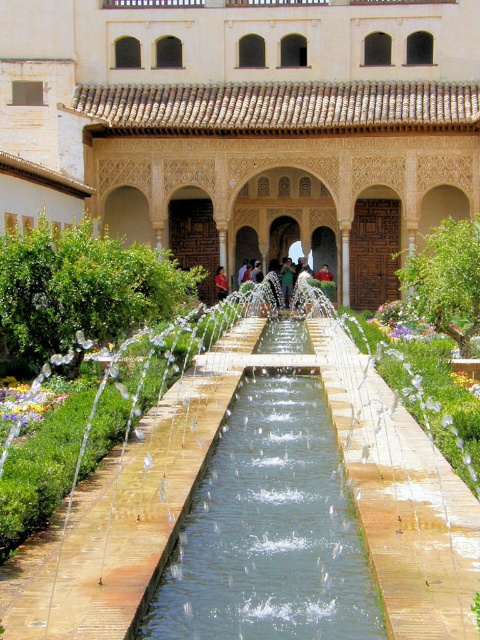
Is green fabric person at center positioned before red fabric person at center?

That is False.

Which is below, green fabric person at center or red fabric person at center?

green fabric person at center is below.

Between point (289, 262) and point (225, 289), which one is positioned behind?

The point (289, 262) is more distant.

Find the location of a particular element. The height and width of the screenshot is (640, 480). green fabric person at center is located at coordinates (287, 280).

Is point (179, 621) positioned after point (224, 292)?

No, it is not.

Between clear glass water at center and red fabric person at center, which one appears on the left side from the viewer's perspective?

red fabric person at center

Is point (228, 632) positioned before point (223, 268)?

Yes.

Where is `clear glass water at center`? clear glass water at center is located at coordinates (269, 529).

This screenshot has height=640, width=480. In order to click on brown wooden palace at center in this screenshot , I will do `click(245, 125)`.

Is point (83, 84) in front of point (275, 429)?

No, it is not.

The image size is (480, 640). I want to click on brown wooden palace at center, so click(245, 125).